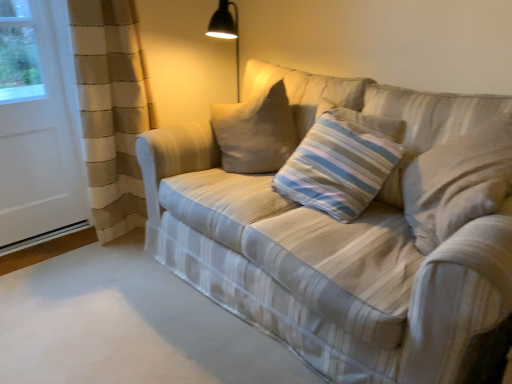
Image resolution: width=512 pixels, height=384 pixels. What are the coordinates of `vacant region in front of white matte screen door at left` in the screenshot? It's located at (40, 276).